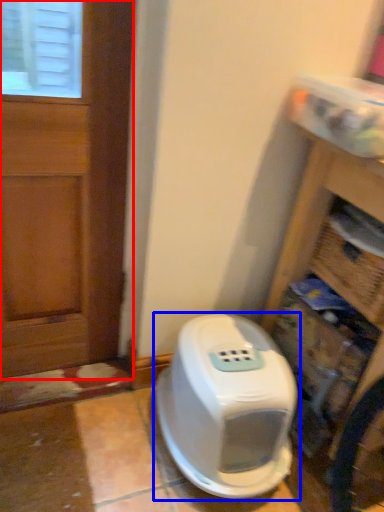
Question: Which point is further to the camera, door (highlighted by a red box) or home appliance (highlighted by a blue box)?

Choices:
 (A) door
 (B) home appliance

Answer: (B)